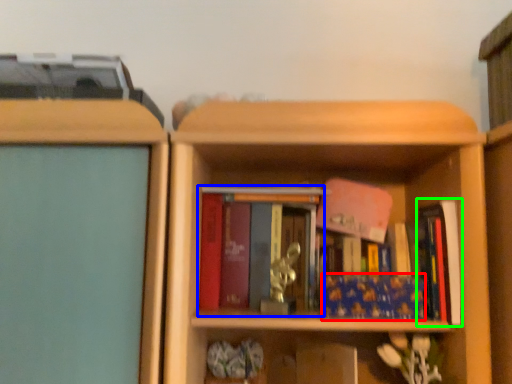
Question: Estimate the real-world distances between objects in this image. Which object is farther from book (highlighted by a red box), book (highlighted by a blue box) or book (highlighted by a green box)?

Choices:
 (A) book
 (B) book

Answer: (A)